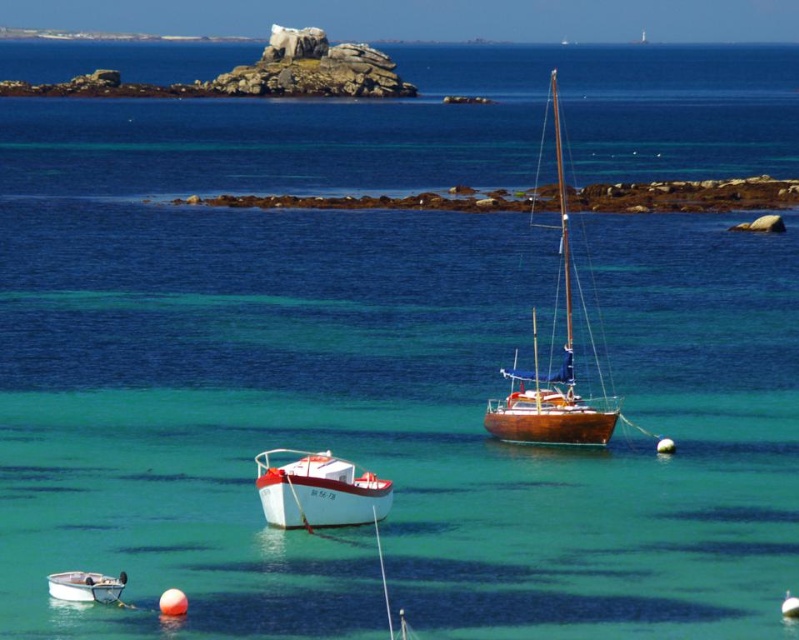
Question: Which point appears closest to the camera in this image?

Choices:
 (A) (261, 481)
 (B) (555, 444)

Answer: (A)

Question: Can you confirm if wooden sailboat at center is smaller than white plastic boat at lower left?

Choices:
 (A) yes
 (B) no

Answer: (B)

Question: Which object is the closest to the wooden sailboat at center?

Choices:
 (A) white matte boat at center
 (B) white plastic boat at lower left

Answer: (A)

Question: Does wooden sailboat at center appear under white plastic boat at lower left?

Choices:
 (A) no
 (B) yes

Answer: (A)

Question: Is white matte boat at center positioned before white plastic boat at lower left?

Choices:
 (A) no
 (B) yes

Answer: (A)

Question: Which of the following is the farthest from the observer?

Choices:
 (A) (113, 579)
 (B) (569, 246)

Answer: (B)